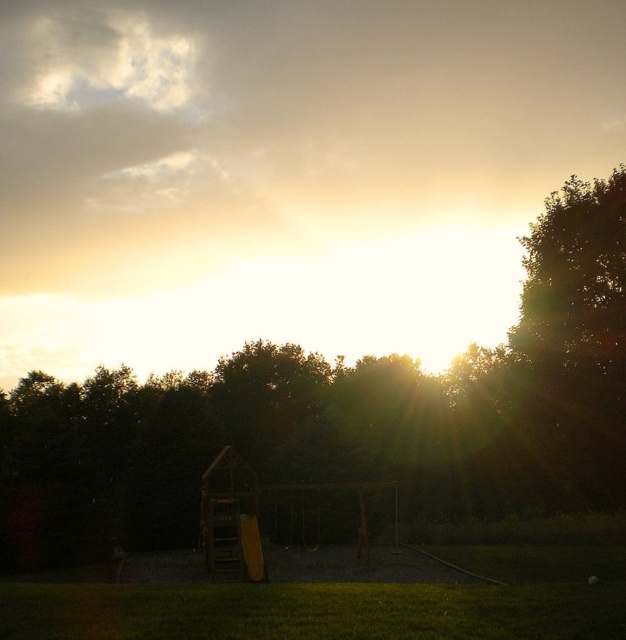
Does point (255, 572) come in front of point (302, 502)?

Yes.

Can you confirm if wooden slide at center is smaller than wooden swing at center?

Yes.

The height and width of the screenshot is (640, 626). Identify the location of wooden slide at center. (250, 547).

The width and height of the screenshot is (626, 640). I want to click on wooden slide at center, so click(250, 547).

Can you confirm if green grass at lower center is wider than wooden swing at center?

Yes, green grass at lower center is wider than wooden swing at center.

How distant is green grass at lower center from wooden swing at center?

The distance of green grass at lower center from wooden swing at center is 36.17 feet.

Locate an element on the screen. Image resolution: width=626 pixels, height=640 pixels. green grass at lower center is located at coordinates (342, 604).

Between green grass at lower center and wooden slide at center, which one has less height?

Standing shorter between the two is wooden slide at center.

Looking at this image, which of these two, green grass at lower center or wooden slide at center, stands taller?

Standing taller between the two is green grass at lower center.

Is point (580, 577) positioned before point (249, 570)?

Yes, it is.

Where is `green grass at lower center`? green grass at lower center is located at coordinates (342, 604).